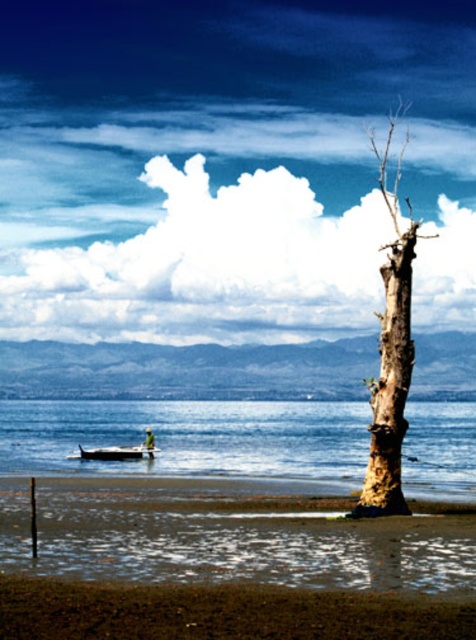
This screenshot has height=640, width=476. Describe the element at coordinates (390, 353) in the screenshot. I see `brown rough bark tree at right` at that location.

Is point (408, 352) positioned after point (129, 452)?

No, (408, 352) is in front of (129, 452).

Identify the location of brown rough bark tree at right. (390, 353).

Does brown sandy beach at lower center have a smaller size compared to metallic silver boat at lower left?

Yes.

Is brown sandy beach at lower center to the right of metallic silver boat at lower left from the viewer's perspective?

Correct, you'll find brown sandy beach at lower center to the right of metallic silver boat at lower left.

Between point (119, 627) and point (155, 451), which one is positioned in front?

Point (119, 627)

I want to click on brown sandy beach at lower center, so [221, 611].

Based on the photo, is clear blue water at center to the left of metallic silver boat at lower left from the viewer's perspective?

In fact, clear blue water at center is to the right of metallic silver boat at lower left.

Is clear blue water at center further to camera compared to metallic silver boat at lower left?

No, it is in front of metallic silver boat at lower left.

Who is more forward, (x=202, y=474) or (x=116, y=460)?

Point (x=202, y=474) is in front.

Image resolution: width=476 pixels, height=640 pixels. Identify the location of clear blue water at center. (192, 438).